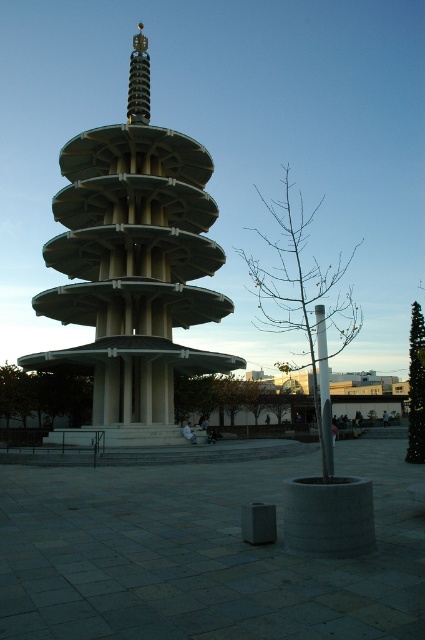
Question: Is green concrete tower at center bigger than matte gray pillar at center?

Choices:
 (A) no
 (B) yes

Answer: (B)

Question: Is green concrete tower at center further to the viewer compared to matte gray pillar at center?

Choices:
 (A) yes
 (B) no

Answer: (A)

Question: Which object appears farthest from the camera in this image?

Choices:
 (A) matte gray pillar at center
 (B) green concrete tower at center

Answer: (B)

Question: Is green concrete tower at center below matte gray pillar at center?

Choices:
 (A) no
 (B) yes

Answer: (A)

Question: Which point is closer to the camera?

Choices:
 (A) green concrete tower at center
 (B) matte gray pillar at center

Answer: (B)